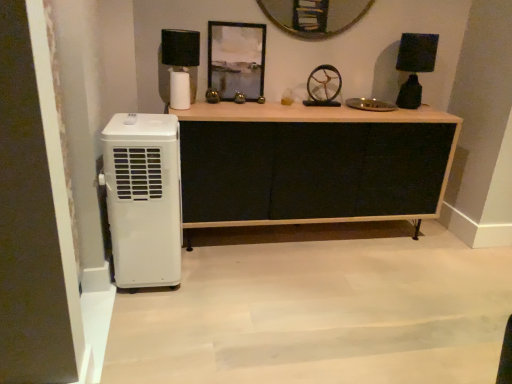
Identify the location of unoccupied area in front of black matte lamp at right, arranged as the 1th lamp when viewed from the right. The width and height of the screenshot is (512, 384). click(x=420, y=114).